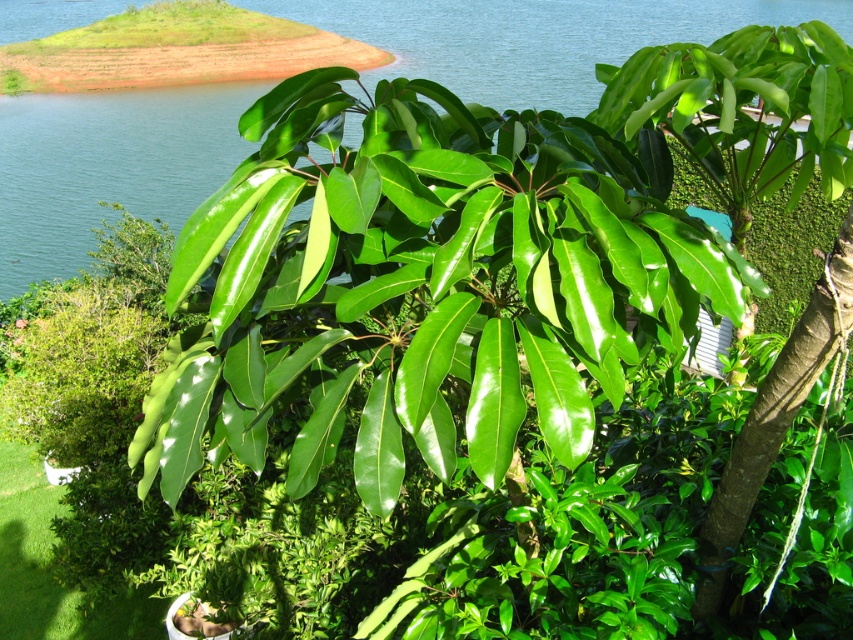
Which is more to the right, green water at upper center or green glossy leaves at center?

green glossy leaves at center

Who is more distant from viewer, (592, 51) or (828, 33)?

Positioned behind is point (592, 51).

Where is `green water at upper center`? green water at upper center is located at coordinates (107, 166).